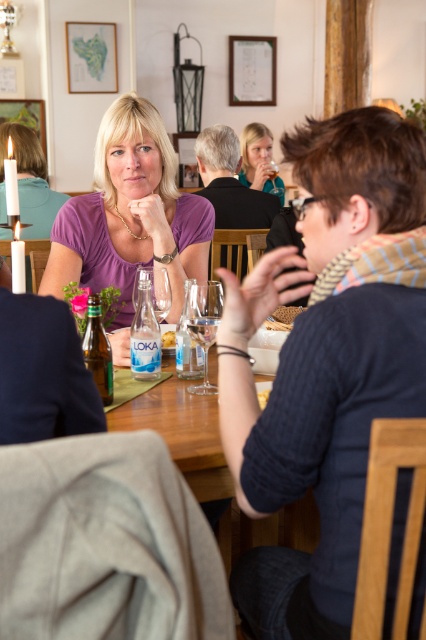
Question: Where is matte black wine glass at upper center located in relation to white paper plate at center in the image?

Choices:
 (A) right
 (B) left

Answer: (A)

Question: Among these points, which one is farthest from the camera?

Choices:
 (A) (256, 179)
 (B) (160, 362)
 (C) (187, 346)
 (D) (264, 406)

Answer: (A)

Question: Can you confirm if transparent glass wine glass at center is thinner than clear plastic bottle at center?

Choices:
 (A) yes
 (B) no

Answer: (A)

Question: Among these points, which one is nearest to the camera?

Choices:
 (A) (x=189, y=340)
 (B) (x=261, y=403)

Answer: (B)

Question: Does transparent glass wine glass at center appear on the left side of white paper plate at center?

Choices:
 (A) yes
 (B) no

Answer: (B)

Question: Which point is closer to the camera?

Choices:
 (A) white paper plate at center
 (B) purple matte shirt at upper center

Answer: (B)